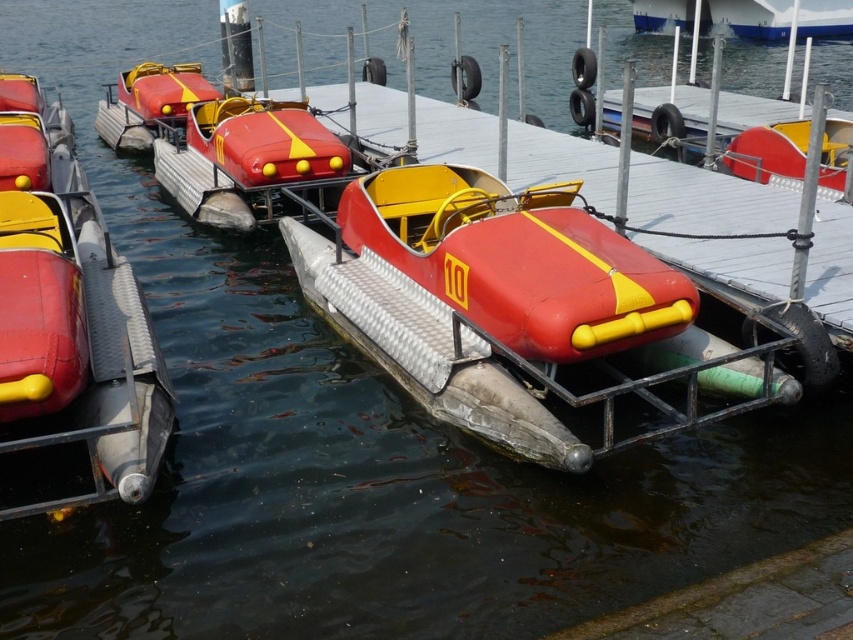
Question: Which of the following is the farthest from the observer?

Choices:
 (A) matte plastic toy car at center
 (B) metallic dock at center

Answer: (B)

Question: Does matte plastic toy car at center appear on the left side of matte red and yellow pedal boat at center?

Choices:
 (A) no
 (B) yes

Answer: (B)

Question: Is matte plastic boat at left below matte plastic toy car at center?

Choices:
 (A) no
 (B) yes

Answer: (A)

Question: Is matte plastic toy car at center positioned at the back of metallic dock at center?

Choices:
 (A) no
 (B) yes

Answer: (A)

Question: Which object appears farthest from the camera in this image?

Choices:
 (A) metallic dock at center
 (B) matte plastic toy car at center
 (C) matte plastic boat at left

Answer: (A)

Question: Which of the following is the farthest from the observer?

Choices:
 (A) metallic dock at center
 (B) matte plastic toy car at center

Answer: (A)